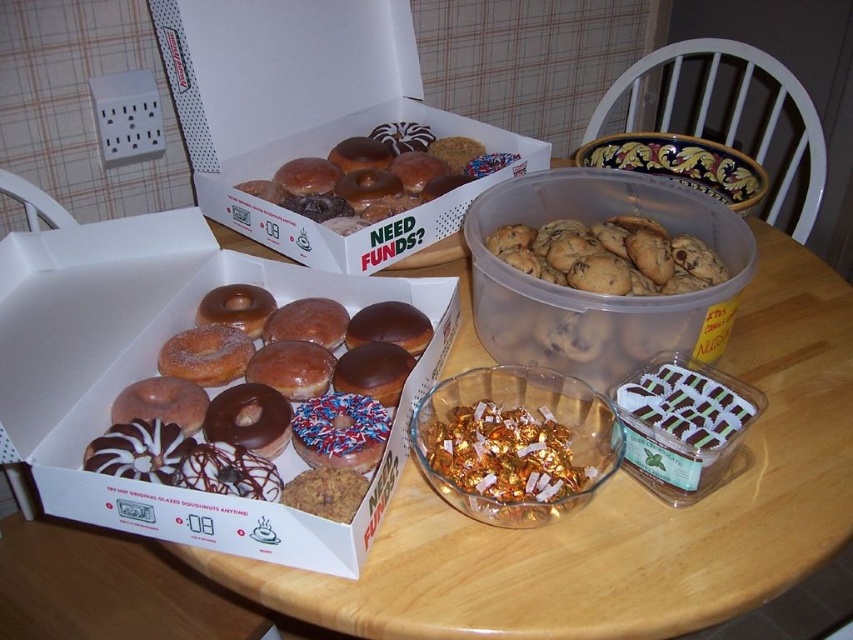
What are the coordinates of the white cardboard box of donuts at left?

The white cardboard box of donuts at left is located at coordinates point (155, 372).

You are at a party and want to grab a treat. You see the white cardboard box of donuts at left and the chocolate chip cookies at center. Which one is closer to the center of the table?

The chocolate chip cookies at center are exactly at the center of the table, while the white cardboard box of donuts at left is positioned to the left of them. Therefore, the chocolate chip cookies at center are closer to the center of the table.

You are a delivery person who needs to place a new item on the table. The table is represented as a coordinate system where the bottom left corner is the origin point. The coordinates are given as a pair of numbers between 0 and 1, with 0,0 being the bottom left corner and 1,1 being the top right corner. You must place the item exactly at the location of the white cardboard box at upper center. What are the coordinates where you should place the item?

The coordinates for the white cardboard box at upper center are 0.180 in the x axis and 0.362 in the y axis, so you should place the item at the coordinates (308, 115).